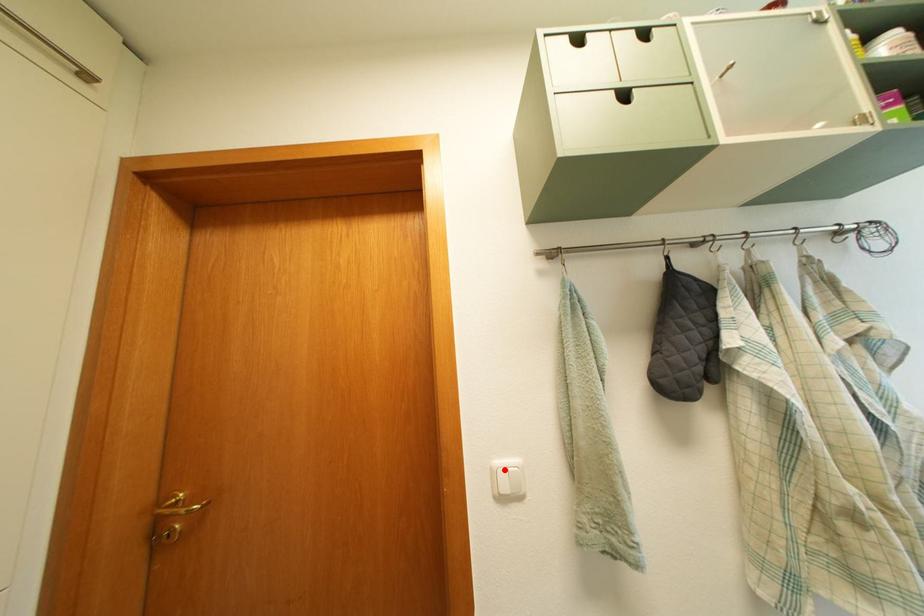
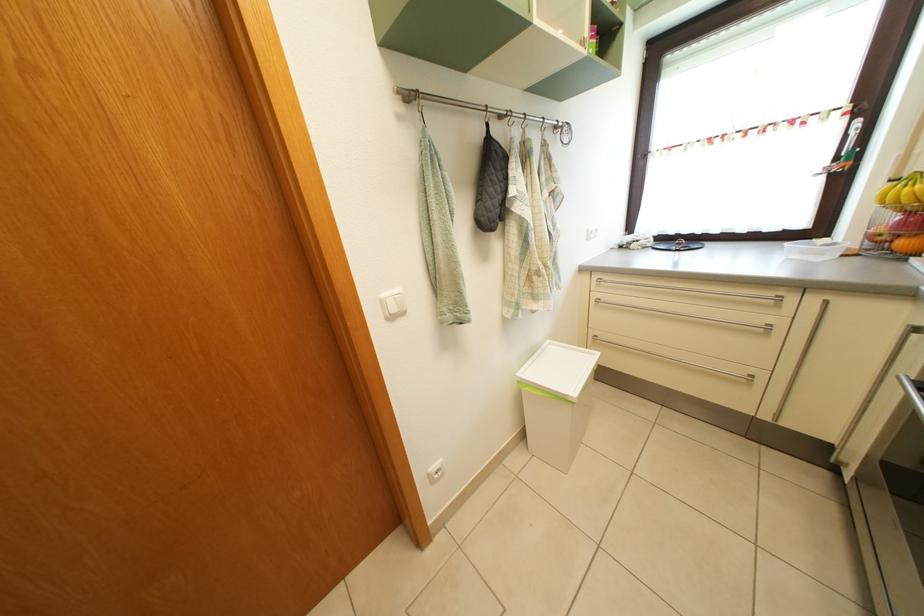
In the second image, find the point that corresponds to the highlighted location in the first image.

(392, 302)